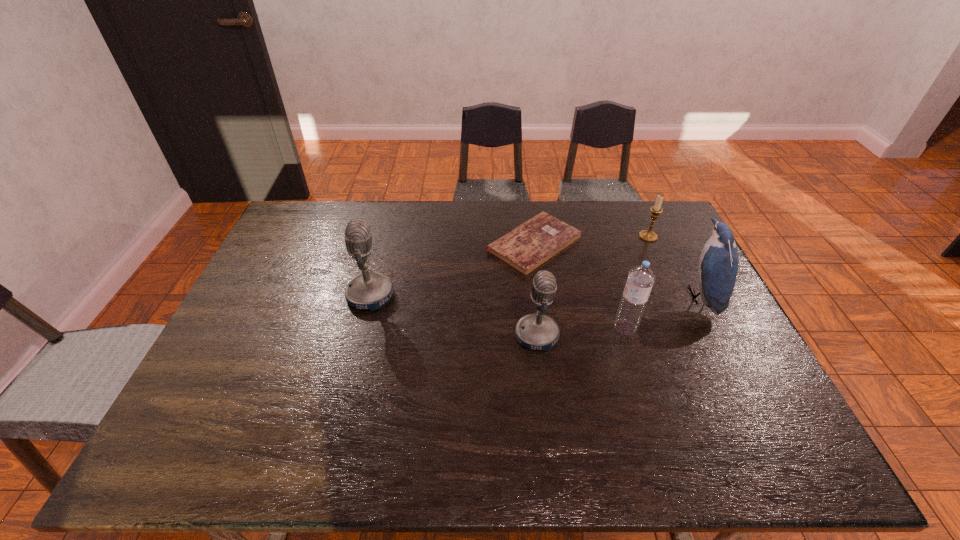
Image resolution: width=960 pixels, height=540 pixels. In order to click on bird located in the right edge section of the desktop in this screenshot , I will do `click(718, 263)`.

Locate an element on the screen. The width and height of the screenshot is (960, 540). object present at the far right corner is located at coordinates (648, 235).

Locate an element on the screen. The height and width of the screenshot is (540, 960). vacant space at the far edge of the desktop is located at coordinates (624, 214).

The image size is (960, 540). In the image, there is a desktop. In order to click on vacant space at the near edge in this screenshot , I will do `click(454, 389)`.

In the image, there is a desktop. At what (x,y) coordinates should I click in order to perform the action: click on vacant space at the left edge. Please return your answer as a coordinate pair (x, y). Looking at the image, I should click on (248, 296).

The height and width of the screenshot is (540, 960). I want to click on vacant region at the right edge of the desktop, so click(x=748, y=355).

You are a GUI agent. You are given a task and a screenshot of the screen. Output one action in this format:
    pyautogui.click(x=<x>, y=<y>)
    Task: Click on the vacant space at the far left corner of the desktop
    
    Given the screenshot: What is the action you would take?
    pyautogui.click(x=288, y=218)

I want to click on vacant space at the near right corner of the desktop, so click(x=717, y=395).

Where is `free spot between the shortest object and the left microphone`? free spot between the shortest object and the left microphone is located at coordinates [x=452, y=269].

What are the coordinates of `blank region between the shortest object and the left microphone` in the screenshot? It's located at point(452,269).